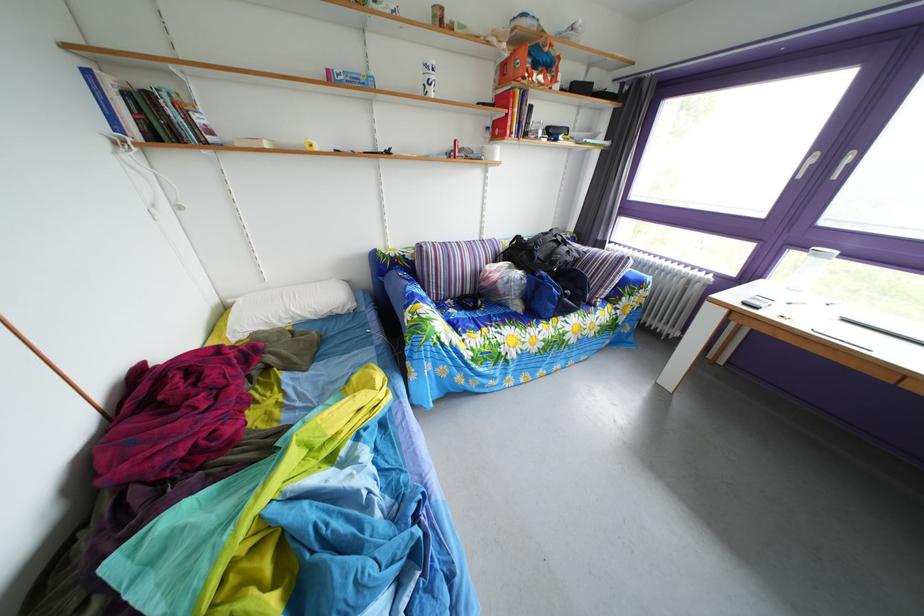
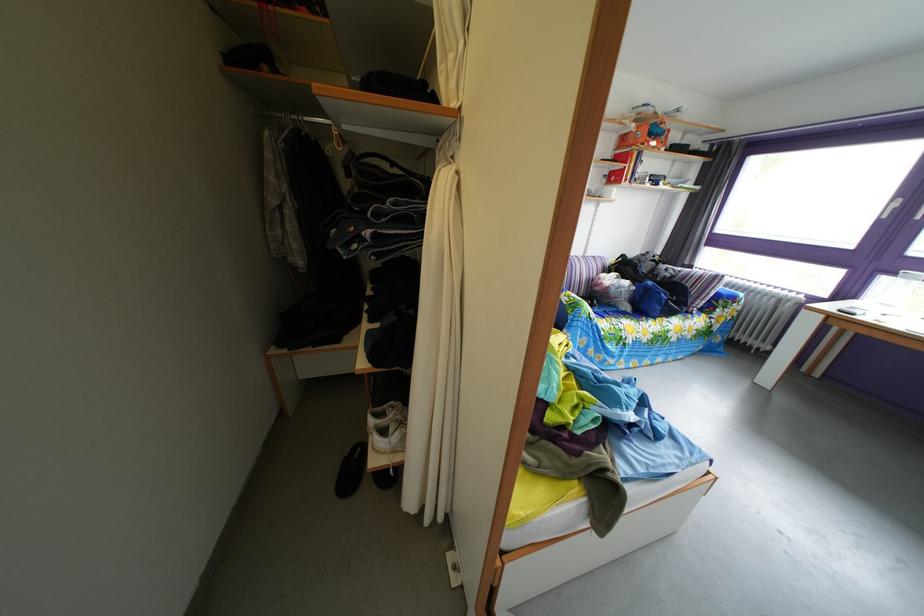
Find the pixel in the second image that matches (502,132) in the first image.

(618, 180)